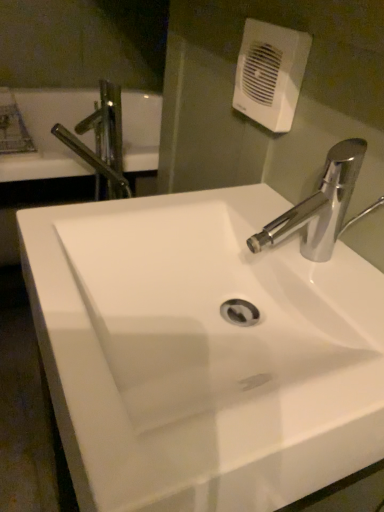
Question: From a real-world perspective, is white plastic hand dryer at upper center positioned under metallic chrome tap at upper left based on gravity?

Choices:
 (A) no
 (B) yes

Answer: (A)

Question: Is white plastic hand dryer at upper center wider than metallic chrome tap at upper left?

Choices:
 (A) yes
 (B) no

Answer: (B)

Question: Is there a large distance between white plastic hand dryer at upper center and metallic chrome tap at upper left?

Choices:
 (A) yes
 (B) no

Answer: (B)

Question: Can you confirm if white plastic hand dryer at upper center is shorter than metallic chrome tap at upper left?

Choices:
 (A) yes
 (B) no

Answer: (A)

Question: Is white plastic hand dryer at upper center smaller than metallic chrome tap at upper left?

Choices:
 (A) yes
 (B) no

Answer: (A)

Question: Considering the positions of white glossy sink at center and white plastic hand dryer at upper center in the image, is white glossy sink at center bigger or smaller than white plastic hand dryer at upper center?

Choices:
 (A) small
 (B) big

Answer: (B)

Question: From the image's perspective, is white glossy sink at center positioned above or below white plastic hand dryer at upper center?

Choices:
 (A) below
 (B) above

Answer: (A)

Question: Considering the positions of point (187, 407) and point (299, 36), is point (187, 407) closer or farther from the camera than point (299, 36)?

Choices:
 (A) closer
 (B) farther

Answer: (A)

Question: Is white glossy sink at center situated inside white plastic hand dryer at upper center or outside?

Choices:
 (A) outside
 (B) inside

Answer: (A)

Question: Is point (115, 114) positioned closer to the camera than point (140, 399)?

Choices:
 (A) closer
 (B) farther

Answer: (B)

Question: From the image's perspective, relative to white glossy sink at center, is metallic chrome tap at upper left above or below?

Choices:
 (A) above
 (B) below

Answer: (A)

Question: In terms of size, does metallic chrome tap at upper left appear bigger or smaller than white glossy sink at center?

Choices:
 (A) small
 (B) big

Answer: (A)

Question: Is metallic chrome tap at upper left taller or shorter than white glossy sink at center?

Choices:
 (A) tall
 (B) short

Answer: (B)

Question: Considering the positions of white glossy sink at center and metallic chrome tap at upper left in the image, is white glossy sink at center bigger or smaller than metallic chrome tap at upper left?

Choices:
 (A) big
 (B) small

Answer: (A)

Question: Considering the positions of white glossy sink at center and metallic chrome tap at upper left in the image, is white glossy sink at center taller or shorter than metallic chrome tap at upper left?

Choices:
 (A) tall
 (B) short

Answer: (A)